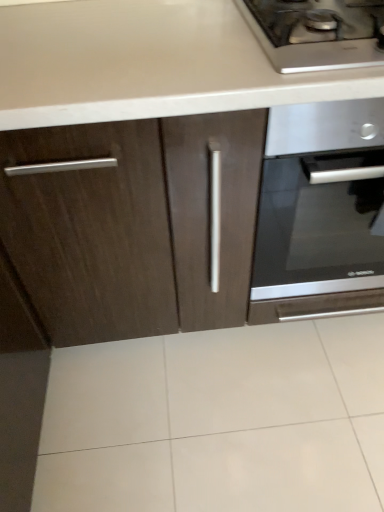
Question: From the image's perspective, is stainless steel gas stove at upper right above or below satin silver oven at center-right?

Choices:
 (A) below
 (B) above

Answer: (B)

Question: In terms of size, does stainless steel gas stove at upper right appear bigger or smaller than satin silver oven at center-right?

Choices:
 (A) big
 (B) small

Answer: (B)

Question: In the image, is stainless steel gas stove at upper right positioned in front of or behind satin silver oven at center-right?

Choices:
 (A) front
 (B) behind

Answer: (A)

Question: Considering the positions of point (279, 237) and point (334, 64), is point (279, 237) closer or farther from the camera than point (334, 64)?

Choices:
 (A) farther
 (B) closer

Answer: (A)

Question: From a real-world perspective, relative to stainless steel gas stove at upper right, is satin silver oven at center-right vertically above or below?

Choices:
 (A) above
 (B) below

Answer: (B)

Question: From the image's perspective, is satin silver oven at center-right located above or below stainless steel gas stove at upper right?

Choices:
 (A) below
 (B) above

Answer: (A)

Question: In terms of width, does satin silver oven at center-right look wider or thinner when compared to stainless steel gas stove at upper right?

Choices:
 (A) thin
 (B) wide

Answer: (B)